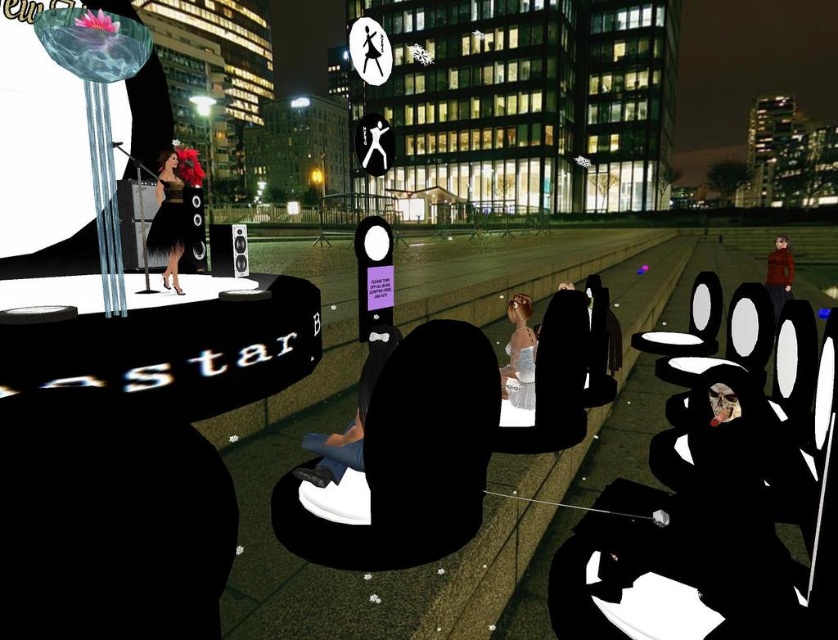
You are a photographer at a fashion show. You have two dresses on the stage, a black satin dress at center and a silky white dress at center. Which dress should you focus on if you want to capture the one that takes up more space in the photo?

The silky white dress at center is larger in size compared to the black satin dress at center, so focusing on the silky white dress at center would capture the one that takes up more space in the photo.

You are an event coordinator planning to place a 1.2 meter tall decorative column between the black satin dress at center and the red wool sweater at right. Considering their heights, which object will the column block more from view?

The black satin dress at center has a lesser height compared to the red wool sweater at right. Therefore, the column will block the black satin dress at center more from view since it is shorter and positioned behind the column.

You are an event coordinator planning the lighting for the stage. You need to ensure that both the silky white dress at center and the red wool sweater at right are equally visible to the audience. Given their height difference, how should you adjust the lighting?

The silky white dress at center is shorter than the red wool sweater at right. To ensure equal visibility, you can position the lights higher above the silky white dress at center to illuminate it more directly, while angling the lights slightly downward for the taller red wool sweater at right to avoid shadows.